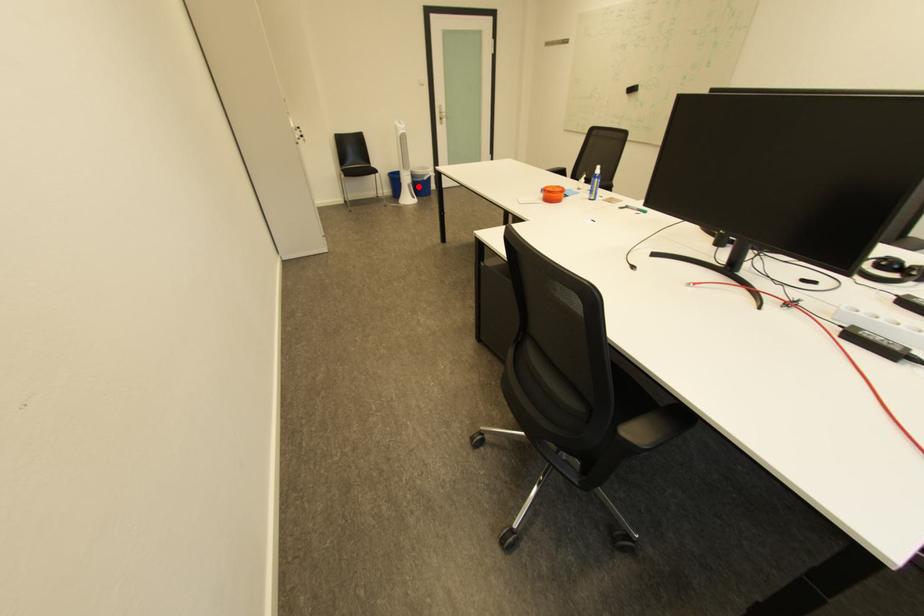
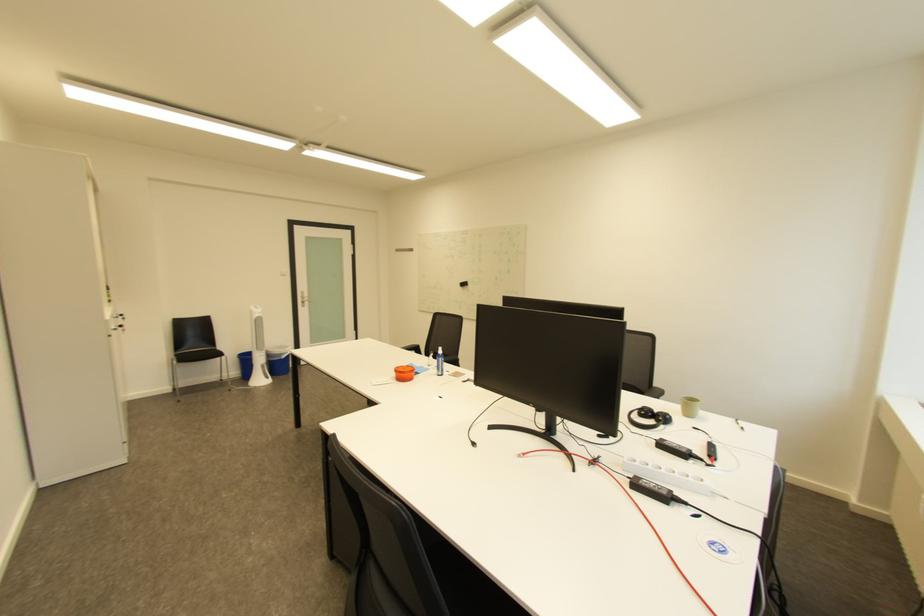
Question: I am providing you with two images of the same scene from different viewpoints. A red point is shown in image1. For the corresponding object point in image2, is it positioned nearer or farther from the camera?

Choices:
 (A) Nearer
 (B) Farther

Answer: (B)